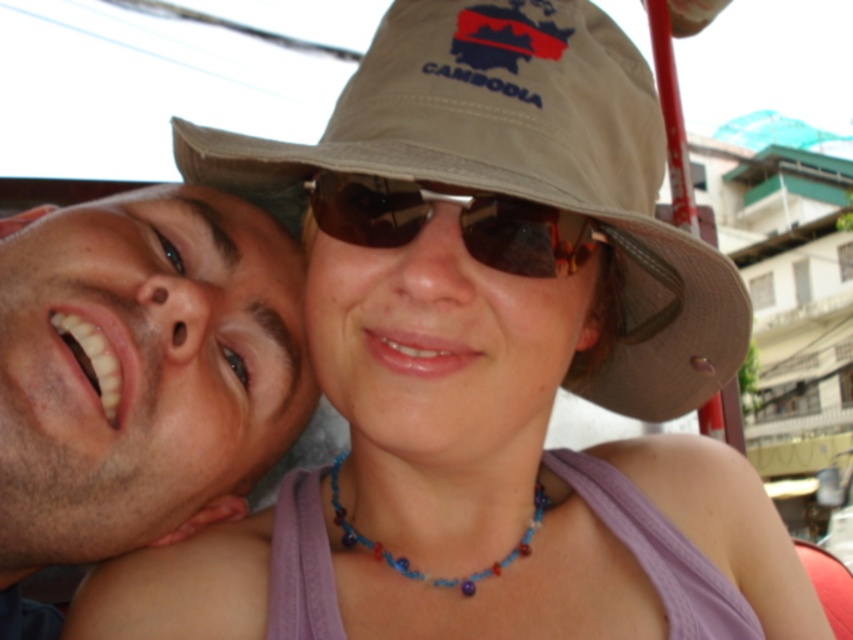
Which of these two, matte brown hat at center or brown reflective sunglasses at center, stands taller?

matte brown hat at center

In the scene shown: Which is above, matte brown hat at center or brown reflective sunglasses at center?

Positioned higher is brown reflective sunglasses at center.

Which is in front, point (613, 257) or point (581, 230)?

Point (581, 230) is in front.

You are a GUI agent. You are given a task and a screenshot of the screen. Output one action in this format:
    pyautogui.click(x=<x>, y=<y>)
    Task: Click on the matte brown hat at center
    This screenshot has height=640, width=853.
    Given the screenshot: What is the action you would take?
    pyautogui.click(x=474, y=237)

Who is higher up, khaki fabric hat at center or brown reflective sunglasses at center?

Positioned higher is brown reflective sunglasses at center.

Which is more to the left, khaki fabric hat at center or brown reflective sunglasses at center?

Positioned to the left is brown reflective sunglasses at center.

Which is behind, point (532, 51) or point (323, 189)?

The point (323, 189) is behind.

In order to click on khaki fabric hat at center in this screenshot , I will do `click(521, 172)`.

Who is more forward, (47, 536) or (520, 276)?

Point (520, 276) is in front.

Is matte skin face at left taller than matte brown hat at center?

Correct, matte skin face at left is much taller as matte brown hat at center.

Is point (251, 428) more distant than point (415, 225)?

Yes, point (251, 428) is farther from viewer.

This screenshot has height=640, width=853. What are the coordinates of `matte skin face at left` in the screenshot? It's located at (141, 369).